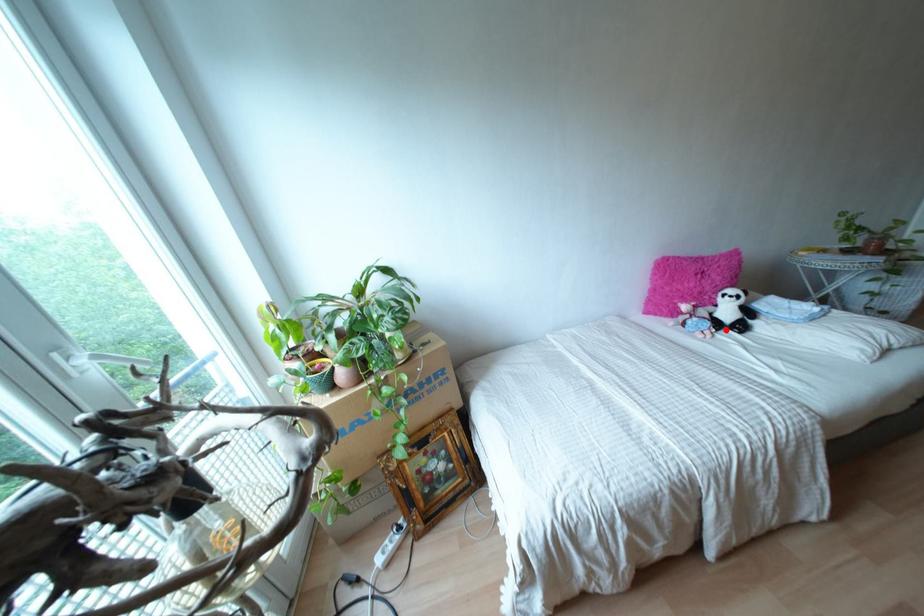
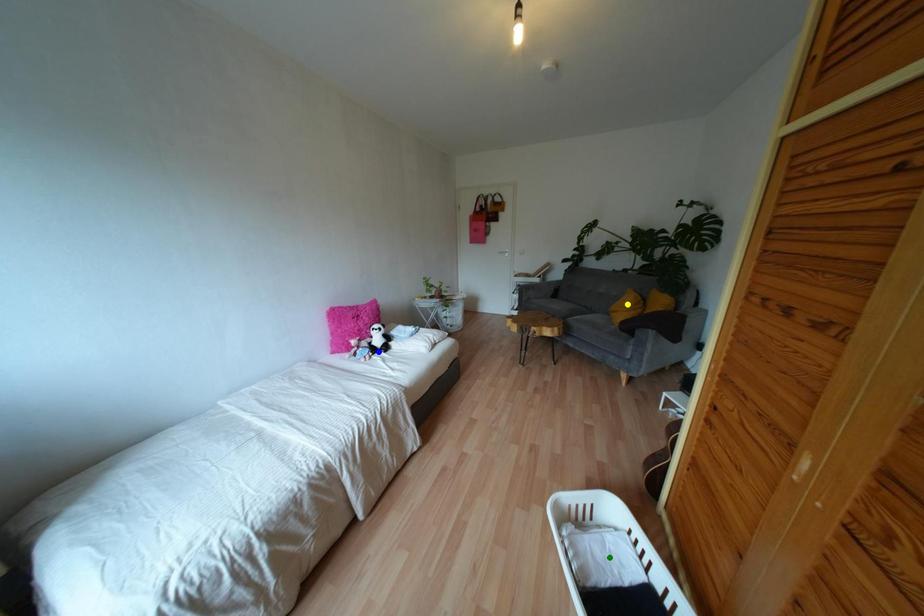
Question: I am providing you with two images of the same scene from different viewpoints. A red point is marked on the first image. You are given multiple points on the second image. Which mark in image 2 goes with the point in image 1?

Choices:
 (A) green point
 (B) blue point
 (C) yellow point

Answer: (B)